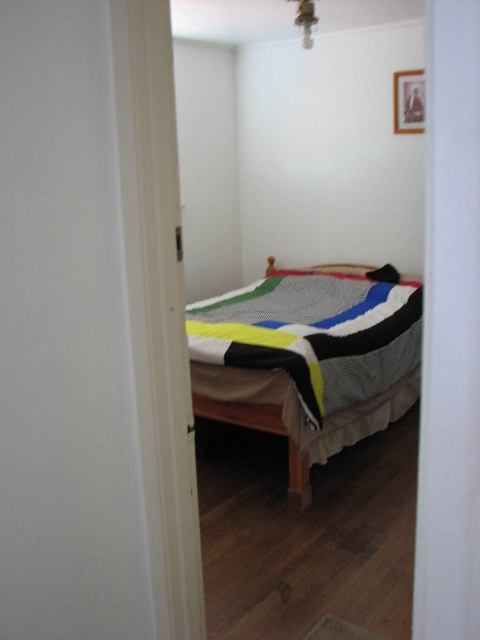
You are a guest entering the bedroom and want to make sure the knitted fabric bed at center is properly set up. Is the black fabric pillow at center placed correctly according to the room layout?

The knitted fabric bed at center is positioned under the black fabric pillow at center, so the pillow is correctly placed on top of the bed.